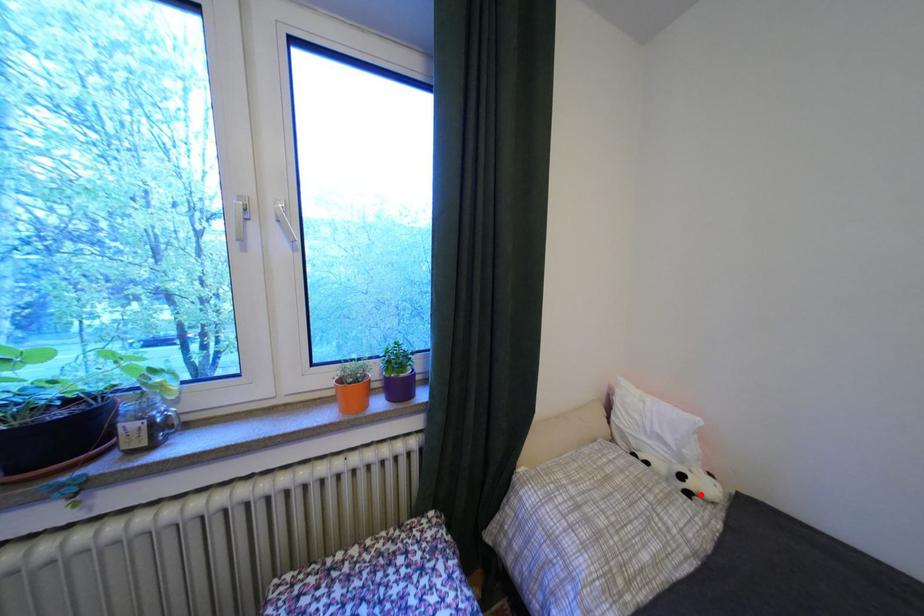
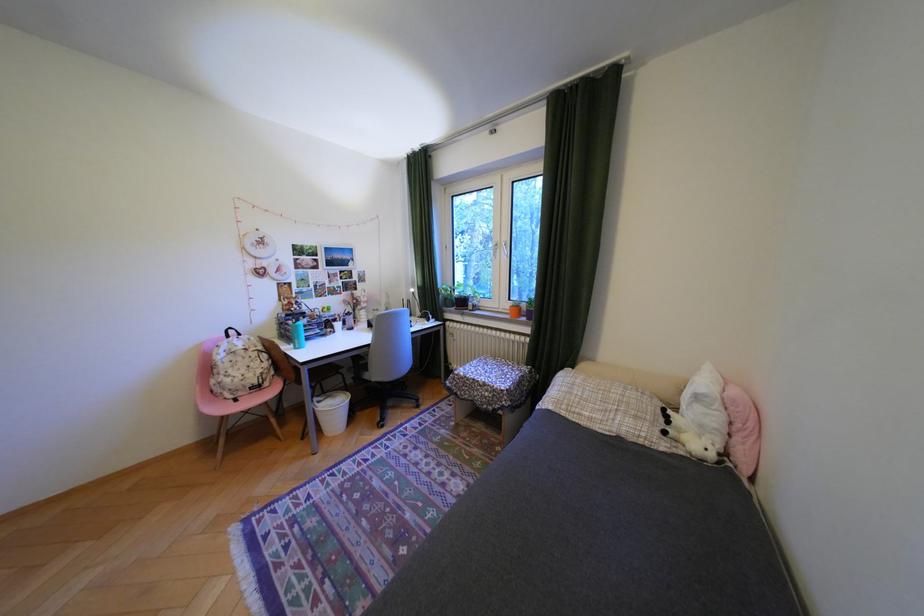
Find the pixel in the second image that matches the highlighted location in the first image.

(676, 432)